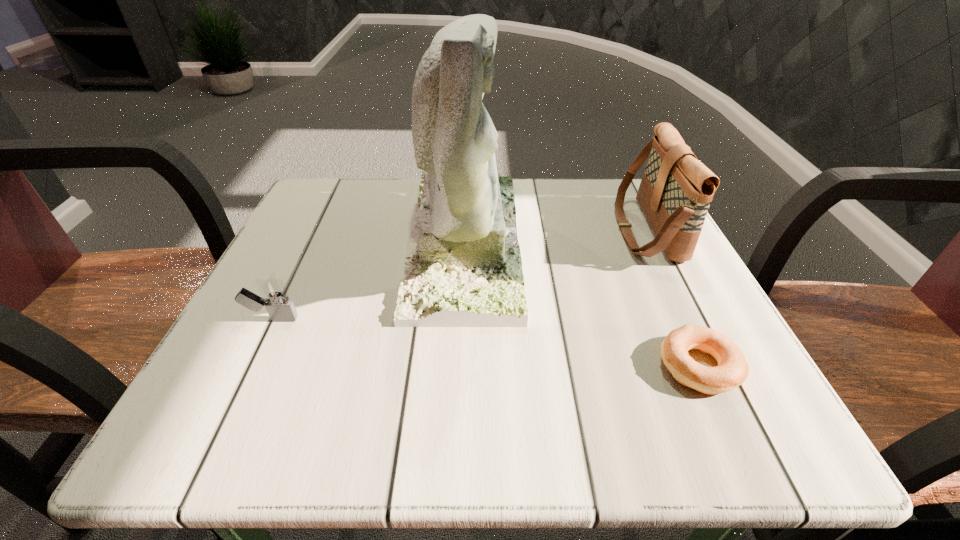
Find the location of a particular element. sculpture is located at coordinates (463, 269).

Where is `the tallest object`? This screenshot has width=960, height=540. the tallest object is located at coordinates (463, 269).

Where is `shoulder bag`? The image size is (960, 540). shoulder bag is located at coordinates (676, 189).

Find the location of a particular element. The height and width of the screenshot is (540, 960). the leftmost object is located at coordinates (275, 298).

What are the coordinates of `igniter` in the screenshot? It's located at (275, 298).

The image size is (960, 540). I want to click on the nearest object, so click(732, 370).

Identify the location of the shortest object. (732, 370).

Identify the location of vacant space located 0.090m on the base of the tallest object. This screenshot has height=540, width=960. (563, 240).

Locate an element on the screen. vacant space located 0.260m on the front-facing side of the second tallest object is located at coordinates (493, 230).

Where is `vacant space situated on the front-facing side of the second tallest object`? vacant space situated on the front-facing side of the second tallest object is located at coordinates (575, 230).